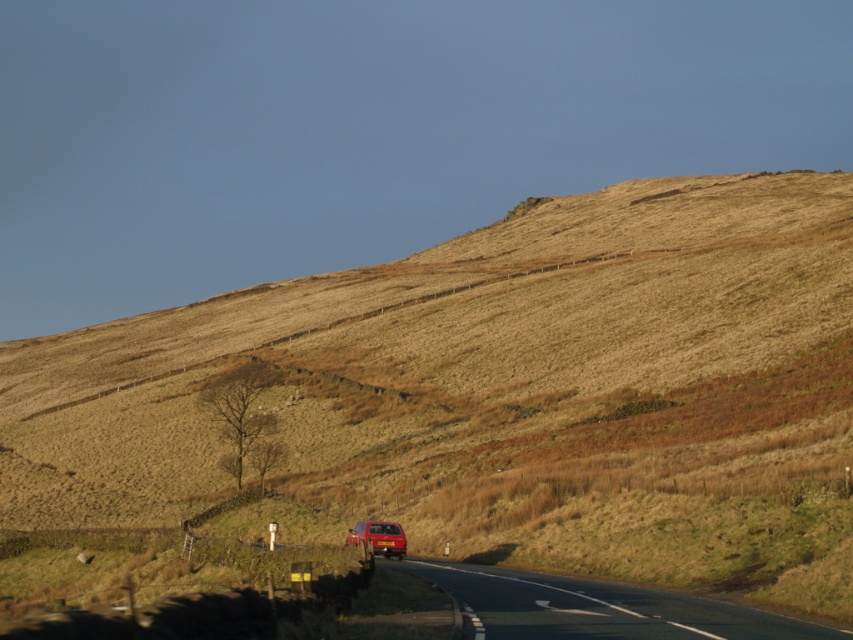
Measure the distance between black asphalt road at lower center and matte red car at center.

The distance of black asphalt road at lower center from matte red car at center is 5.76 meters.

Between black asphalt road at lower center and matte red car at center, which one has less height?

black asphalt road at lower center is shorter.

Does point (636, 612) come behind point (370, 532)?

No.

Locate an element on the screen. black asphalt road at lower center is located at coordinates (601, 609).